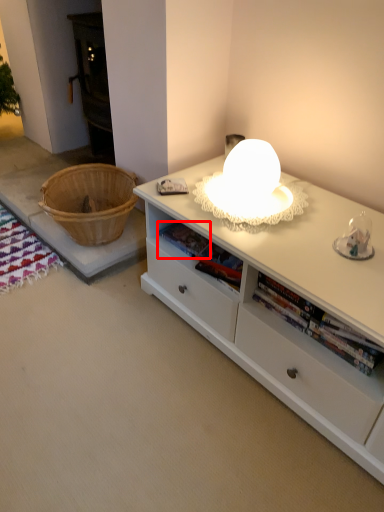
Question: From the image's perspective, where is book (annotated by the red box) located relative to desk?

Choices:
 (A) below
 (B) above

Answer: (A)